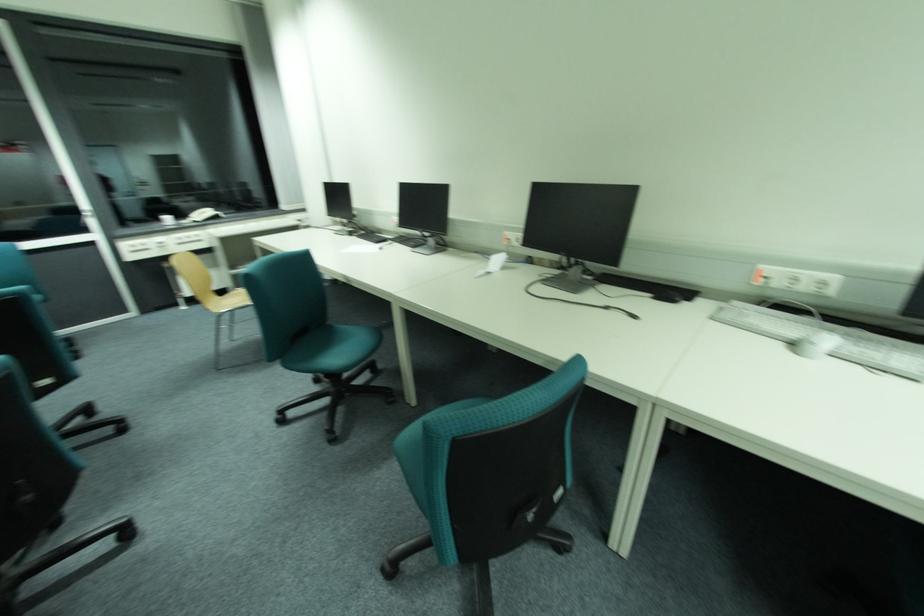
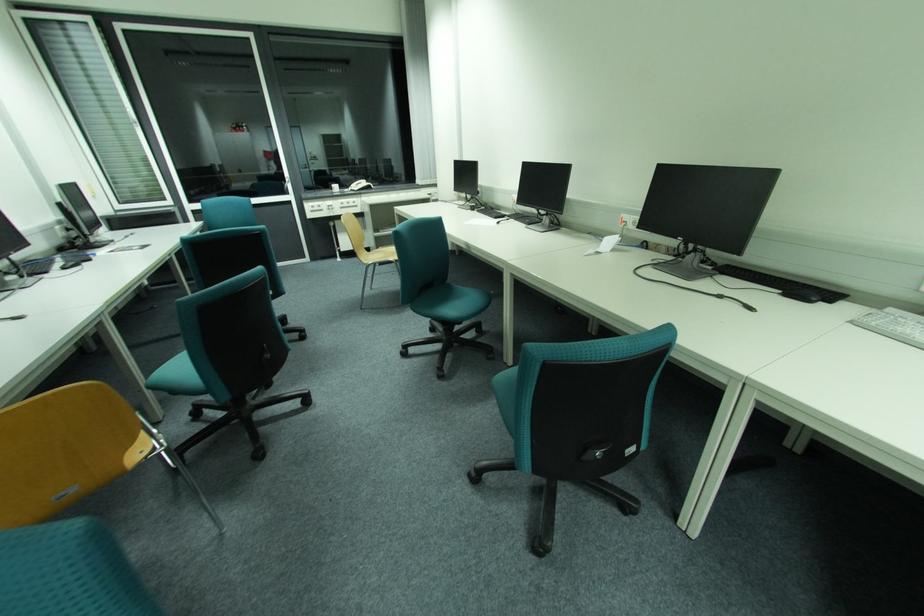
Question: In a continuous first-person perspective shot, in which direction is the camera moving?

Choices:
 (A) Left
 (B) Right
 (C) Forward
 (D) Backward

Answer: (D)